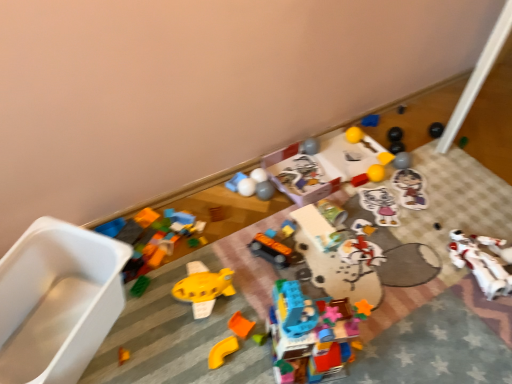
I want to click on vacant area that lies between matte plastic sticker at center, positioned as the 16th toy in left-to-right order, and orange matte plastic toy at lower center, the fifteenth toy viewed from the right, so click(353, 241).